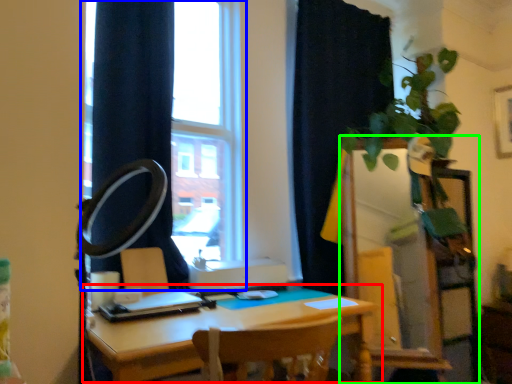
Question: Which object is positioned closest to table (highlighted by a red box)? Select from window (highlighted by a blue box) and dresser (highlighted by a green box).

Choices:
 (A) window
 (B) dresser

Answer: (B)